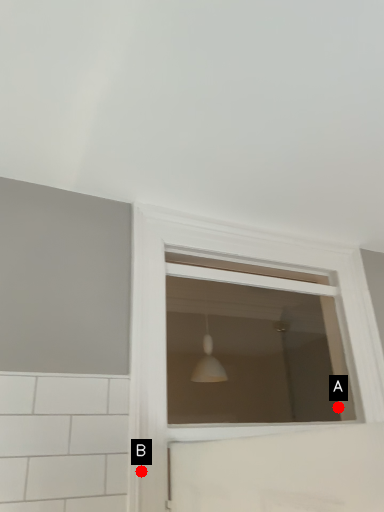
Question: Two points are circled on the image, labeled by A and B beside each circle. Which of the following is the farthest from the observer?

Choices:
 (A) A is further
 (B) B is further

Answer: (A)